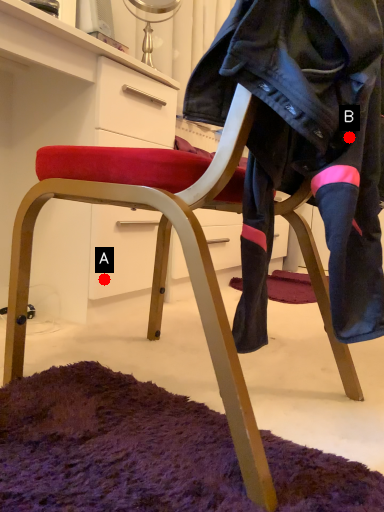
Question: Two points are circled on the image, labeled by A and B beside each circle. Which point appears farthest from the camera in this image?

Choices:
 (A) A is further
 (B) B is further

Answer: (A)